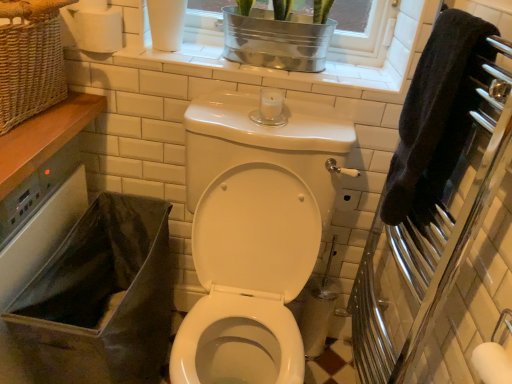
Where is `free space above white tile window frame at upper center, the first window frame when ordered from left to right (from a real-world perspective)`? free space above white tile window frame at upper center, the first window frame when ordered from left to right (from a real-world perspective) is located at coordinates (217, 51).